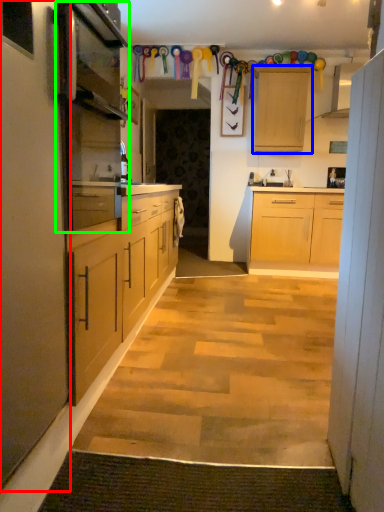
Question: Considering the real-world distances, which object is closest to cabinet (highlighted by a red box)? cabinetry (highlighted by a blue box) or appliance (highlighted by a green box).

Choices:
 (A) cabinetry
 (B) appliance

Answer: (B)